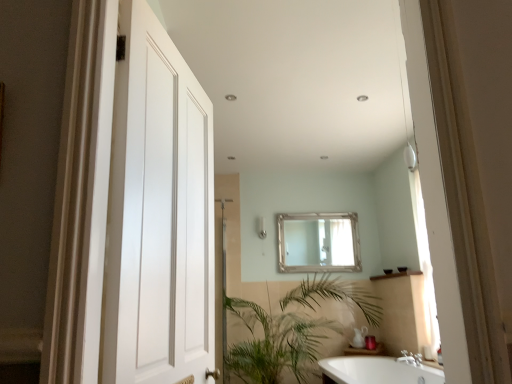
Question: Does green leafy plant at lower center appear on the left side of silver metallic mirror at center?

Choices:
 (A) no
 (B) yes

Answer: (B)

Question: Is green leafy plant at lower center touching silver metallic mirror at center?

Choices:
 (A) no
 (B) yes

Answer: (A)

Question: Can you confirm if green leafy plant at lower center is shorter than silver metallic mirror at center?

Choices:
 (A) no
 (B) yes

Answer: (A)

Question: Would you say silver metallic mirror at center is part of green leafy plant at lower center's contents?

Choices:
 (A) no
 (B) yes

Answer: (A)

Question: Is green leafy plant at lower center bigger than silver metallic mirror at center?

Choices:
 (A) yes
 (B) no

Answer: (A)

Question: Looking at their shapes, would you say green leafy plant at lower center is wider or thinner than white matte door at left?

Choices:
 (A) wide
 (B) thin

Answer: (A)

Question: Considering the positions of green leafy plant at lower center and white matte door at left in the image, is green leafy plant at lower center bigger or smaller than white matte door at left?

Choices:
 (A) big
 (B) small

Answer: (A)

Question: From the image's perspective, is green leafy plant at lower center located above or below white matte door at left?

Choices:
 (A) above
 (B) below

Answer: (B)

Question: Does point (223, 357) appear closer or farther from the camera than point (188, 190)?

Choices:
 (A) closer
 (B) farther

Answer: (B)

Question: Is satin nickel shower at center taller or shorter than green leafy plant at lower center?

Choices:
 (A) tall
 (B) short

Answer: (B)

Question: From a real-world perspective, is satin nickel shower at center above or below green leafy plant at lower center?

Choices:
 (A) below
 (B) above

Answer: (B)

Question: In terms of size, does satin nickel shower at center appear bigger or smaller than green leafy plant at lower center?

Choices:
 (A) big
 (B) small

Answer: (B)

Question: Is satin nickel shower at center in front of or behind green leafy plant at lower center in the image?

Choices:
 (A) front
 (B) behind

Answer: (B)

Question: Is point (264, 228) closer or farther from the camera than point (315, 233)?

Choices:
 (A) farther
 (B) closer

Answer: (B)

Question: From the image's perspective, is satin nickel shower at center located above or below silver metallic mirror at center?

Choices:
 (A) below
 (B) above

Answer: (B)